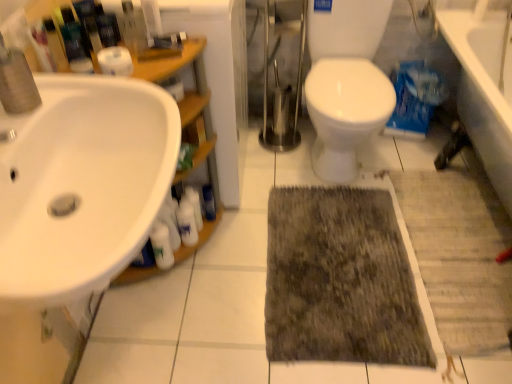
Question: Which direction should I rotate to face white glossy bottle at center, positioned as the 2th toiletry in left-to-right order, — up or down?

Choices:
 (A) up
 (B) down

Answer: (B)

Question: Is dark gray shaggy rug at center not close to white glossy bottle at lower left, marked as the second toiletry in a right-to-left arrangement?

Choices:
 (A) yes
 (B) no

Answer: (B)

Question: Is dark gray shaggy rug at center smaller than white glossy bottle at lower left, marked as the second toiletry in a right-to-left arrangement?

Choices:
 (A) yes
 (B) no

Answer: (B)

Question: Is dark gray shaggy rug at center outside white glossy bottle at lower left, marked as the second toiletry in a right-to-left arrangement?

Choices:
 (A) yes
 (B) no

Answer: (A)

Question: From a real-world perspective, is dark gray shaggy rug at center on top of white glossy bottle at lower left, positioned as the 1th toiletry in left-to-right order?

Choices:
 (A) no
 (B) yes

Answer: (A)

Question: Is dark gray shaggy rug at center behind white glossy bottle at lower left, positioned as the 1th toiletry in left-to-right order?

Choices:
 (A) yes
 (B) no

Answer: (B)

Question: Can you confirm if dark gray shaggy rug at center is taller than white glossy bottle at lower left, positioned as the 1th toiletry in left-to-right order?

Choices:
 (A) yes
 (B) no

Answer: (B)

Question: Is white glossy bottle at center, which is the 1th toiletry in right-to-left order, shorter than white glossy bottle at lower left, acting as the 1th cleaning product starting from the right?

Choices:
 (A) no
 (B) yes

Answer: (B)

Question: From the image's perspective, is white glossy bottle at center, which is the 1th toiletry in right-to-left order, on white glossy bottle at lower left, acting as the 1th cleaning product starting from the right?

Choices:
 (A) yes
 (B) no

Answer: (A)

Question: Does white glossy bottle at center, positioned as the 2th toiletry in left-to-right order, turn towards white glossy bottle at lower left, acting as the 1th cleaning product starting from the right?

Choices:
 (A) yes
 (B) no

Answer: (B)

Question: Is white glossy bottle at center, positioned as the 2th toiletry in left-to-right order, positioned with its back to white glossy bottle at lower left, which appears as the second cleaning product when viewed from the left?

Choices:
 (A) no
 (B) yes

Answer: (A)

Question: Considering the relative positions of white glossy bottle at center, positioned as the 2th toiletry in left-to-right order, and white glossy bottle at lower left, which appears as the second cleaning product when viewed from the left, in the image provided, is white glossy bottle at center, positioned as the 2th toiletry in left-to-right order, behind white glossy bottle at lower left, which appears as the second cleaning product when viewed from the left,?

Choices:
 (A) yes
 (B) no

Answer: (A)

Question: Is white glossy bottle at center, which is the 1th toiletry in right-to-left order, in front of white glossy bottle at lower left, acting as the 1th cleaning product starting from the right?

Choices:
 (A) no
 (B) yes

Answer: (A)

Question: Does white glossy bottle at lower left, positioned as the 1th toiletry in left-to-right order, have a greater width compared to white matte toilet paper at upper left?

Choices:
 (A) no
 (B) yes

Answer: (A)